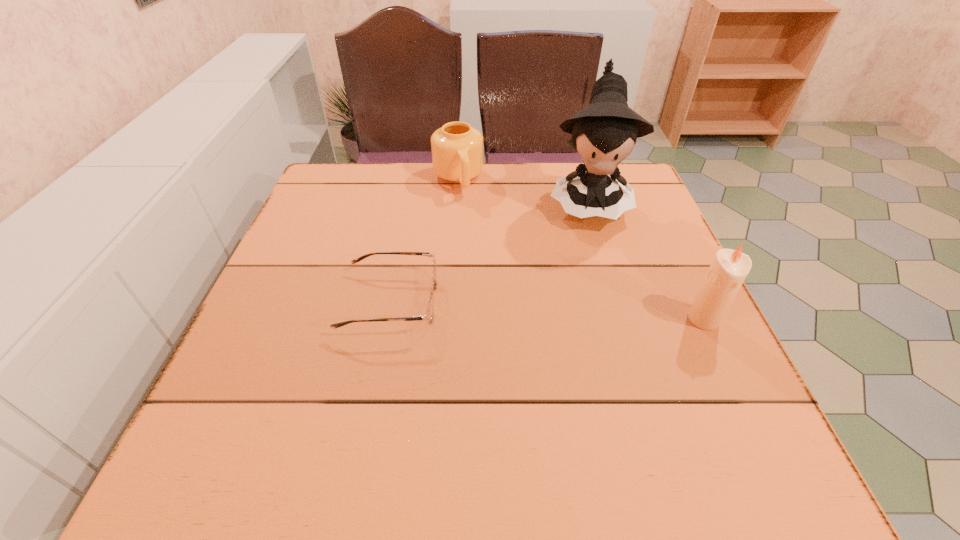
Locate an element on the screen. The height and width of the screenshot is (540, 960). spectacles is located at coordinates (429, 316).

What are the coordinates of `candle` in the screenshot? It's located at (729, 268).

Locate an element on the screen. the third shortest object is located at coordinates (729, 268).

The height and width of the screenshot is (540, 960). What are the coordinates of `the tallest object` in the screenshot? It's located at (604, 133).

At what (x,y) coordinates should I click in order to perform the action: click on doll. Please return your answer as a coordinate pair (x, y). The height and width of the screenshot is (540, 960). Looking at the image, I should click on (604, 133).

Image resolution: width=960 pixels, height=540 pixels. In order to click on mug in this screenshot , I will do (x=457, y=148).

Locate an element on the screen. This screenshot has height=540, width=960. vacant space located on the front-facing side of the spectacles is located at coordinates (636, 302).

Locate an element on the screen. The image size is (960, 540). vacant space located 0.050m on the front of the rightmost object is located at coordinates (720, 354).

Locate an element on the screen. The image size is (960, 540). free spot located 0.060m at the face of the second object from right to left is located at coordinates (591, 252).

Where is `free space located at the face of the second object from right to left`? This screenshot has height=540, width=960. free space located at the face of the second object from right to left is located at coordinates (591, 255).